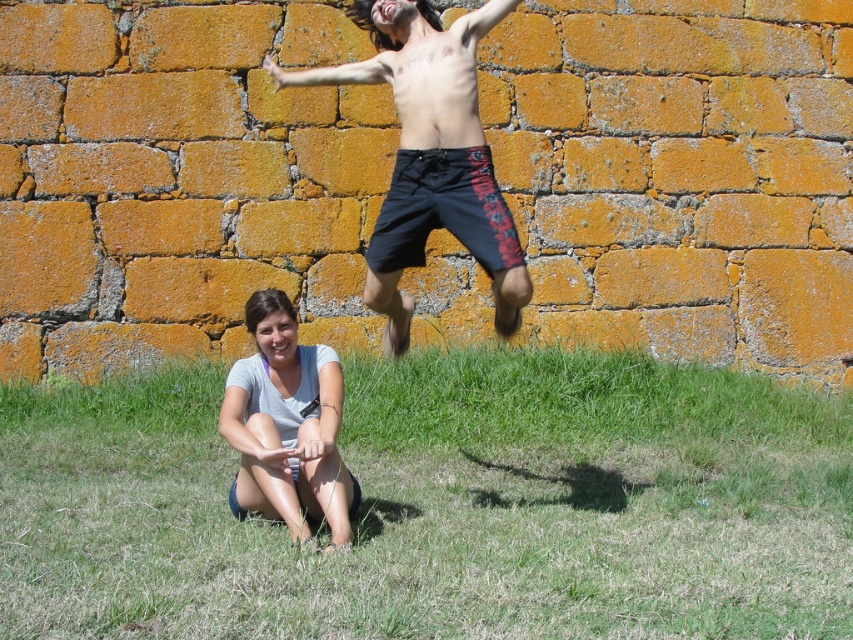
Is green grass at lower center positioned in front of dark blue shorts at upper center?

Yes, it is.

Does green grass at lower center have a smaller size compared to dark blue shorts at upper center?

Correct, green grass at lower center occupies less space than dark blue shorts at upper center.

Measure the distance between point (659, 378) and camera.

34.86 feet

Where is `green grass at lower center`? The image size is (853, 640). green grass at lower center is located at coordinates (440, 506).

Is green grass at lower center wider than gray cotton shirt at lower left?

Indeed, green grass at lower center has a greater width compared to gray cotton shirt at lower left.

Is green grass at lower center to the left of gray cotton shirt at lower left from the viewer's perspective?

Yes, green grass at lower center is to the left of gray cotton shirt at lower left.

Between point (437, 556) and point (294, 516), which one is positioned in front?

Point (437, 556) is more forward.

The width and height of the screenshot is (853, 640). What are the coordinates of `green grass at lower center` in the screenshot? It's located at (440, 506).

The image size is (853, 640). I want to click on dark blue shorts at upper center, so click(x=430, y=156).

Can you confirm if dark blue shorts at upper center is shorter than gray cotton shirt at lower left?

No.

This screenshot has width=853, height=640. Describe the element at coordinates (430, 156) in the screenshot. I see `dark blue shorts at upper center` at that location.

You are a GUI agent. You are given a task and a screenshot of the screen. Output one action in this format:
    pyautogui.click(x=<x>, y=<y>)
    Task: Click on the dark blue shorts at upper center
    The width and height of the screenshot is (853, 640).
    Given the screenshot: What is the action you would take?
    pyautogui.click(x=430, y=156)